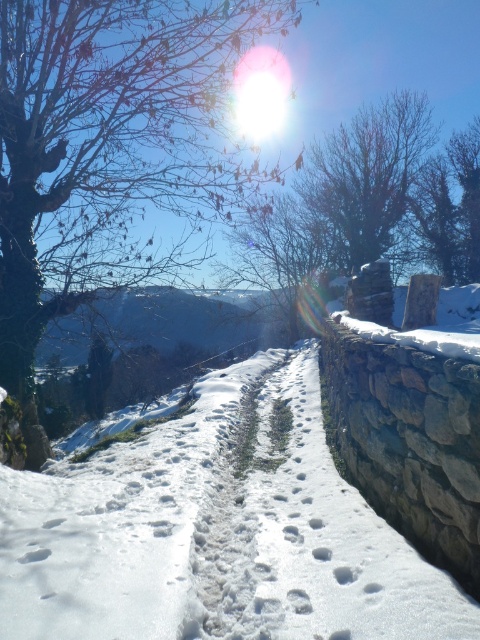
Question: Does white powdery snow at center appear on the right side of bare branches at upper center?

Choices:
 (A) yes
 (B) no

Answer: (B)

Question: Does white powdery snow at center have a larger size compared to bare branches at upper left?

Choices:
 (A) yes
 (B) no

Answer: (B)

Question: Which point is farther to the camera?

Choices:
 (A) bare branches at upper center
 (B) white powdery snow at center
 (C) bare branches at upper left

Answer: (A)

Question: Which of the following is the farthest from the observer?

Choices:
 (A) (187, 476)
 (B) (14, 29)
 (C) (418, 108)

Answer: (C)

Question: In this image, where is bare branches at upper left located relative to bare branches at upper center?

Choices:
 (A) below
 (B) above

Answer: (A)

Question: Which point is closer to the camera taking this photo?

Choices:
 (A) (433, 140)
 (B) (39, 490)
 (C) (21, 403)

Answer: (B)